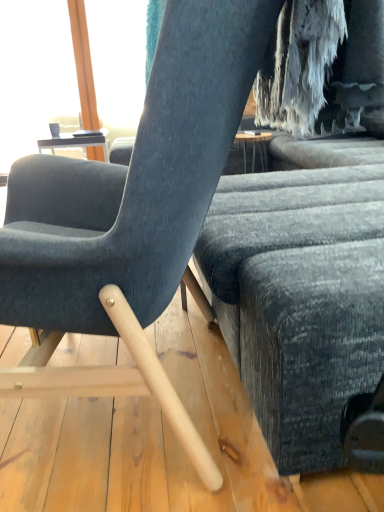
You are a GUI agent. You are given a task and a screenshot of the screen. Output one action in this format:
    pyautogui.click(x=<x>, y=<y>)
    Task: Click on the matte black screen at upper left
    This screenshot has height=512, width=384.
    Given the screenshot: What is the action you would take?
    point(34,74)

Identify the location of matte gray chair at center. This screenshot has width=384, height=512. (131, 215).

Between matte black screen at upper left and matte gray chair at center, which one has larger width?

With larger width is matte gray chair at center.

Can you confirm if matte black screen at upper left is shorter than matte gray chair at center?

No.

Looking at this image, can you confirm if matte black screen at upper left is positioned to the right of matte gray chair at center?

No, matte black screen at upper left is not to the right of matte gray chair at center.

Which is correct: matte black screen at upper left is inside matte gray chair at center, or outside of it?

matte black screen at upper left is not enclosed by matte gray chair at center.

In the image, is textured gray fabric couch at center positioned in front of or behind matte gray chair at center?

In the image, textured gray fabric couch at center appears behind matte gray chair at center.

Between textured gray fabric couch at center and matte gray chair at center, which one appears on the left side from the viewer's perspective?

From the viewer's perspective, matte gray chair at center appears more on the left side.

Looking at this image, is textured gray fabric couch at center wider than matte gray chair at center?

Correct, the width of textured gray fabric couch at center exceeds that of matte gray chair at center.

From the image's perspective, is textured gray fabric couch at center located above or below matte gray chair at center?

Clearly, from the image's perspective, textured gray fabric couch at center is above matte gray chair at center.

In the image, is textured gray fabric couch at center on the left side or the right side of matte black screen at upper left?

Based on their positions, textured gray fabric couch at center is located to the right of matte black screen at upper left.

Does textured gray fabric couch at center have a greater height compared to matte black screen at upper left?

No.

In the scene shown: Could you tell me if textured gray fabric couch at center is facing matte black screen at upper left?

No, textured gray fabric couch at center does not turn towards matte black screen at upper left.

Is matte black screen at upper left taller or shorter than textured gray fabric couch at center?

Clearly, matte black screen at upper left is taller compared to textured gray fabric couch at center.

Are matte black screen at upper left and textured gray fabric couch at center making contact?

No, matte black screen at upper left is not next to textured gray fabric couch at center.

Which is behind, point (22, 110) or point (254, 329)?

Point (22, 110)

There is a textured gray fabric couch at center. At what (x,y) coordinates should I click in order to perform the action: click on window screen above it (from a real-world perspective). Please return your answer as a coordinate pair (x, y). Looking at the image, I should click on (34, 74).

Is matte gray chair at center further to the viewer compared to textured gray fabric couch at center?

No, the depth of matte gray chair at center is less than that of textured gray fabric couch at center.

Considering the relative sizes of matte gray chair at center and textured gray fabric couch at center in the image provided, is matte gray chair at center wider than textured gray fabric couch at center?

No.

Could you tell me if matte gray chair at center is turned towards textured gray fabric couch at center?

No.

Is matte gray chair at center next to textured gray fabric couch at center and touching it?

No, matte gray chair at center is not in contact with textured gray fabric couch at center.

Considering the relative positions of matte gray chair at center and matte black screen at upper left in the image provided, is matte gray chair at center to the left or to the right of matte black screen at upper left?

matte gray chair at center is positioned on matte black screen at upper left's right side.

Considering the sizes of matte gray chair at center and matte black screen at upper left in the image, is matte gray chair at center wider or thinner than matte black screen at upper left?

matte gray chair at center is wider than matte black screen at upper left.

Are matte gray chair at center and matte black screen at upper left making contact?

There is a gap between matte gray chair at center and matte black screen at upper left.

Where is `chair that appears in front of the matte black screen at upper left`? The image size is (384, 512). chair that appears in front of the matte black screen at upper left is located at coordinates (131, 215).

At what (x,y) coordinates should I click in order to perform the action: click on chair above the textured gray fabric couch at center (from a real-world perspective). Please return your answer as a coordinate pair (x, y). This screenshot has height=512, width=384. Looking at the image, I should click on (131, 215).

Considering their positions, is matte gray chair at center positioned closer to matte black screen at upper left than textured gray fabric couch at center?

The object closer to matte black screen at upper left is textured gray fabric couch at center.

Based on their spatial positions, is matte black screen at upper left or textured gray fabric couch at center closer to matte gray chair at center?

textured gray fabric couch at center is positioned closer to the anchor matte gray chair at center.

Looking at this image, from the image, which object appears to be farther from matte black screen at upper left, textured gray fabric couch at center or matte gray chair at center?

The object further to matte black screen at upper left is matte gray chair at center.

Looking at the image, which one is located further to textured gray fabric couch at center, matte black screen at upper left or matte gray chair at center?

matte black screen at upper left is further to textured gray fabric couch at center.

When comparing their distances from matte gray chair at center, does textured gray fabric couch at center or matte black screen at upper left seem closer?

textured gray fabric couch at center lies closer to matte gray chair at center than the other object.

In the scene shown: Based on their spatial positions, is matte gray chair at center or matte black screen at upper left closer to textured gray fabric couch at center?

matte gray chair at center lies closer to textured gray fabric couch at center than the other object.

You are a GUI agent. You are given a task and a screenshot of the screen. Output one action in this format:
    pyautogui.click(x=<x>, y=<y>)
    Task: Click on the studio couch between matte gray chair at center and matte black screen at upper left from front to back
    The width and height of the screenshot is (384, 512).
    Given the screenshot: What is the action you would take?
    pyautogui.click(x=305, y=297)